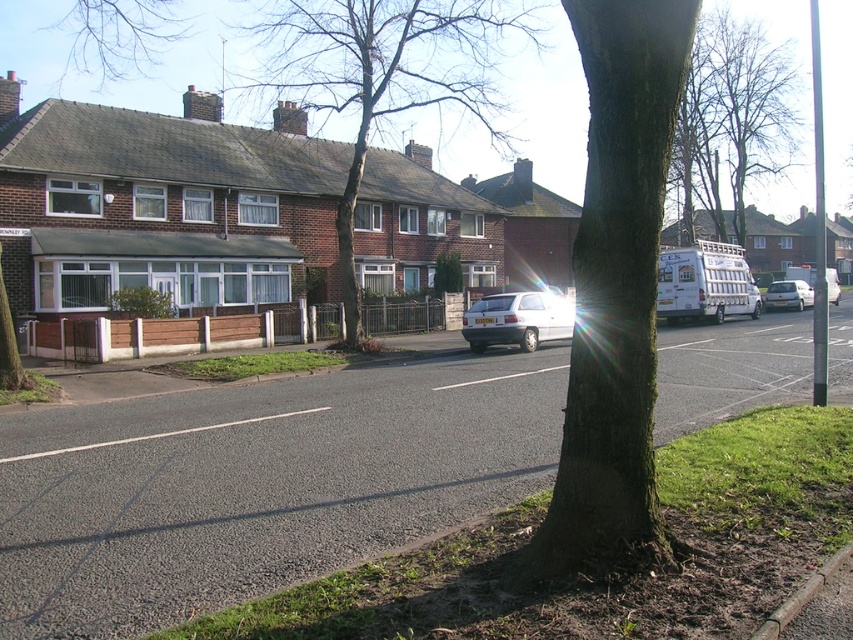
Question: From the image, what is the correct spatial relationship of bare branches at upper center in relation to white matte van at right?

Choices:
 (A) below
 (B) above

Answer: (B)

Question: Which object is positioned farthest from the bare branches at upper center?

Choices:
 (A) green mossy tree trunk at center
 (B) brown bark tree at upper left
 (C) white matte van at center

Answer: (B)

Question: Among these objects, which one is nearest to the camera?

Choices:
 (A) brown bark tree at upper left
 (B) brown textured tree at center
 (C) white matte van at right
 (D) green mossy tree trunk at center

Answer: (D)

Question: Is green mossy tree trunk at center positioned at the back of brown bark tree at upper left?

Choices:
 (A) no
 (B) yes

Answer: (A)

Question: Is brown textured tree at center to the left of brown bark tree at upper left from the viewer's perspective?

Choices:
 (A) no
 (B) yes

Answer: (A)

Question: Based on their relative distances, which object is nearer to the silver metallic hatchback at center?

Choices:
 (A) white matte van at right
 (B) white matte van at center

Answer: (A)